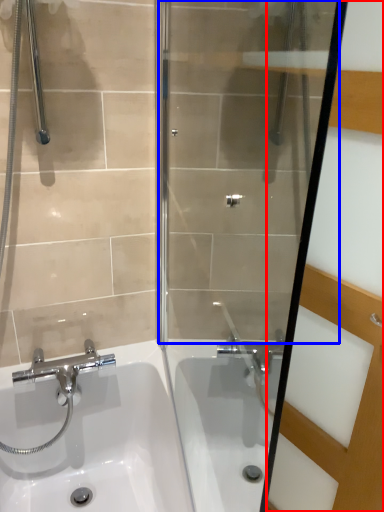
Question: Among these objects, which one is nearest to the camera, screen door (highlighted by a red box) or shower door (highlighted by a blue box)?

Choices:
 (A) screen door
 (B) shower door

Answer: (B)